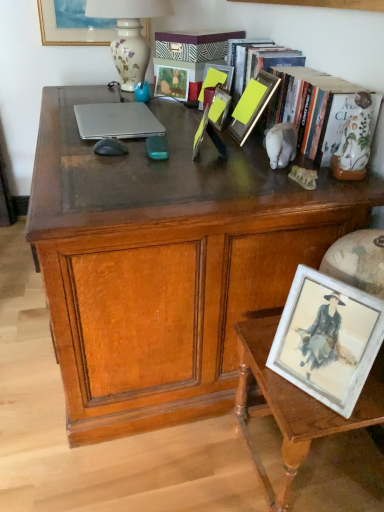
Identify the location of free location in front of silver metallic laptop at center. The image size is (384, 512). (96, 153).